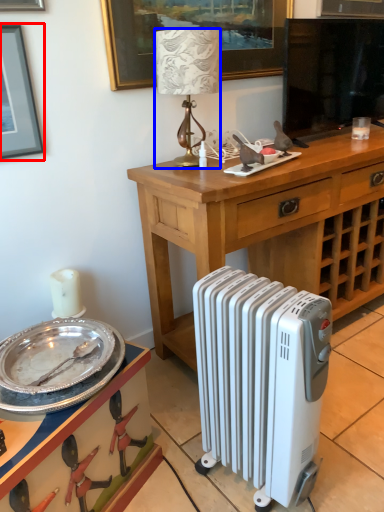
Question: Which of the following is the farthest to the observer, picture frame (highlighted by a red box) or lamp (highlighted by a blue box)?

Choices:
 (A) picture frame
 (B) lamp

Answer: (B)